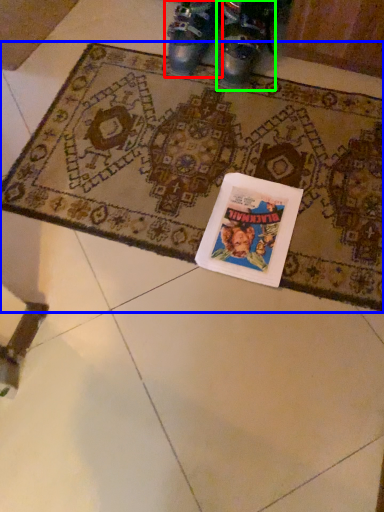
Question: Estimate the real-world distances between objects in this image. Which object is closer to footwear (highlighted by a red box), mat (highlighted by a blue box) or footwear (highlighted by a green box)?

Choices:
 (A) mat
 (B) footwear

Answer: (B)